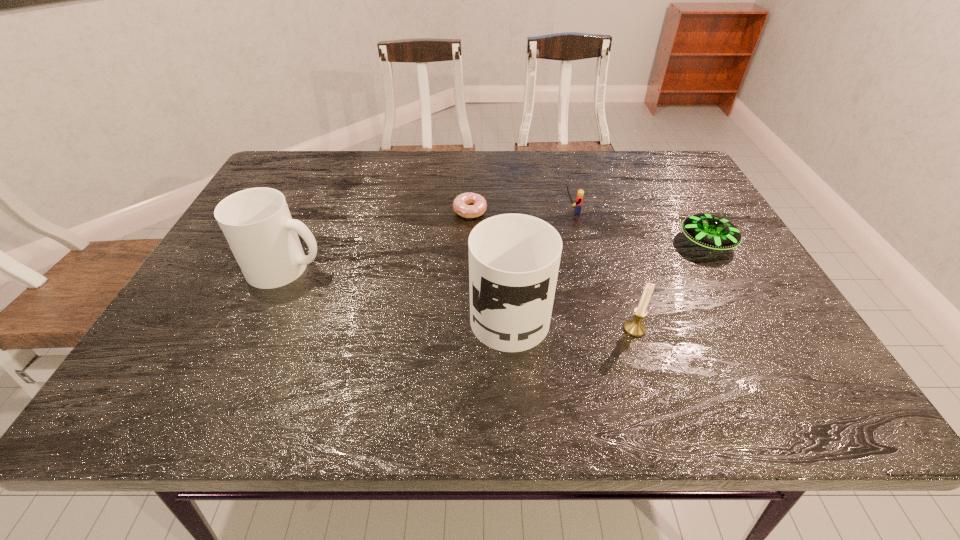
Considering the uniform spacing of mugs, where should an additional mug be positioned on the right? Please locate a free spot. Please provide its 2D coordinates. Your answer should be formatted as a tuple, i.e. [(x, y)], where the tuple contains the x and y coordinates of a point satisfying the conditions above.

[(780, 360)]